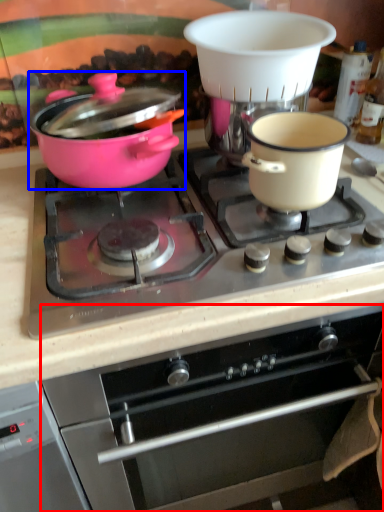
Question: Among these objects, which one is farthest to the camera, oven (highlighted by a red box) or pot/pan (highlighted by a blue box)?

Choices:
 (A) oven
 (B) pot/pan

Answer: (B)